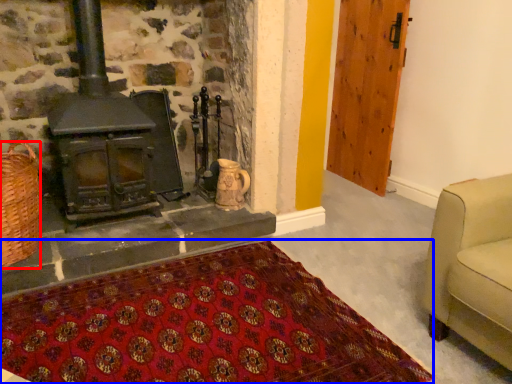
Question: Which object appears farthest to the camera in this image, basket (highlighted by a red box) or mat (highlighted by a blue box)?

Choices:
 (A) basket
 (B) mat

Answer: (A)